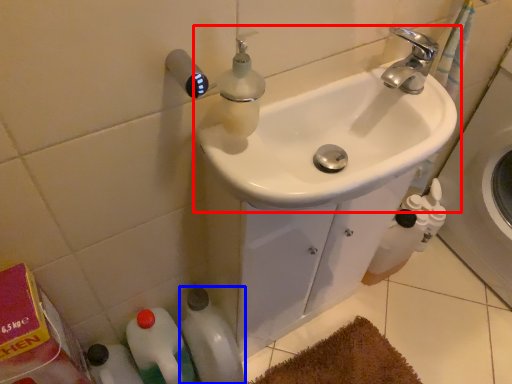
Question: Which of the following is the closest to the observer, sink (highlighted by a red box) or bottle (highlighted by a blue box)?

Choices:
 (A) sink
 (B) bottle

Answer: (A)